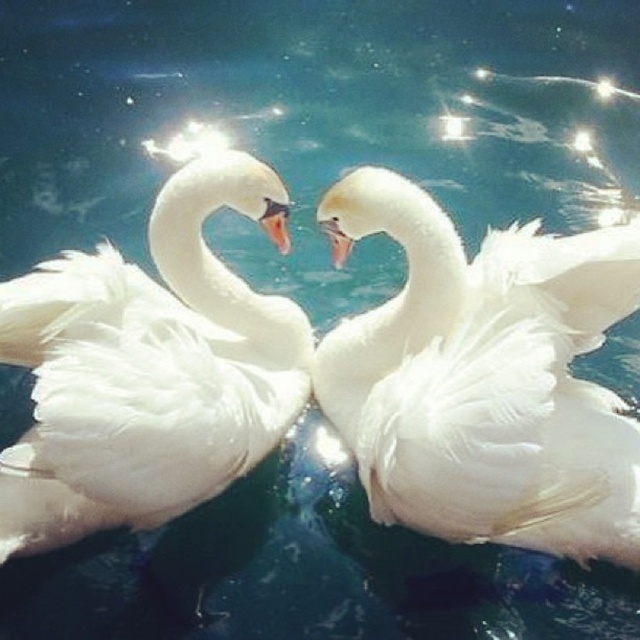
Is white fluffy swan at center below white fluffy swan at left?

Yes, white fluffy swan at center is below white fluffy swan at left.

Which of these two, white fluffy swan at center or white fluffy swan at left, stands shorter?

With less height is white fluffy swan at left.

Does point (536, 472) come in front of point (280, 356)?

Yes, point (536, 472) is closer to viewer.

In order to click on white fluffy swan at center in this screenshot , I will do `click(484, 378)`.